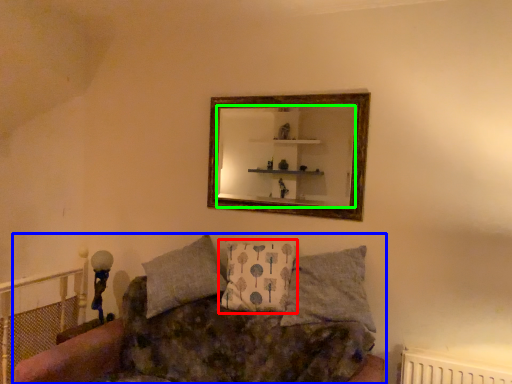
Question: Which object is positioned farthest from pillow (highlighted by a red box)? Select from studio couch (highlighted by a blue box) and mirror (highlighted by a green box).

Choices:
 (A) studio couch
 (B) mirror

Answer: (B)